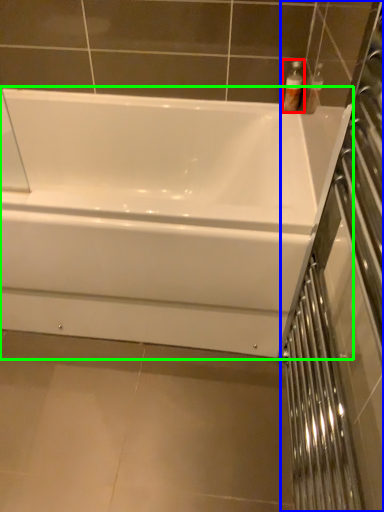
Question: Which object is the closest to the toiletry (highlighted by a red box)? Choose among these: screen door (highlighted by a blue box) or bathtub (highlighted by a green box).

Choices:
 (A) screen door
 (B) bathtub

Answer: (B)